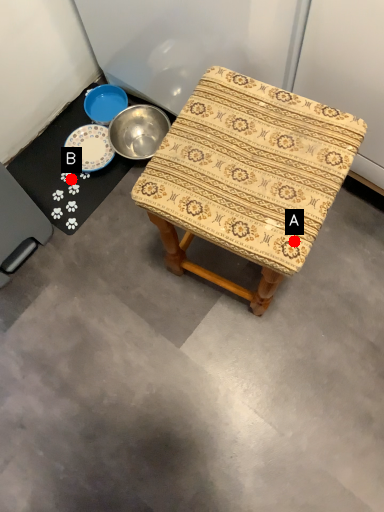
Question: Two points are circled on the image, labeled by A and B beside each circle. Which point is closer to the camera?

Choices:
 (A) A is closer
 (B) B is closer

Answer: (A)